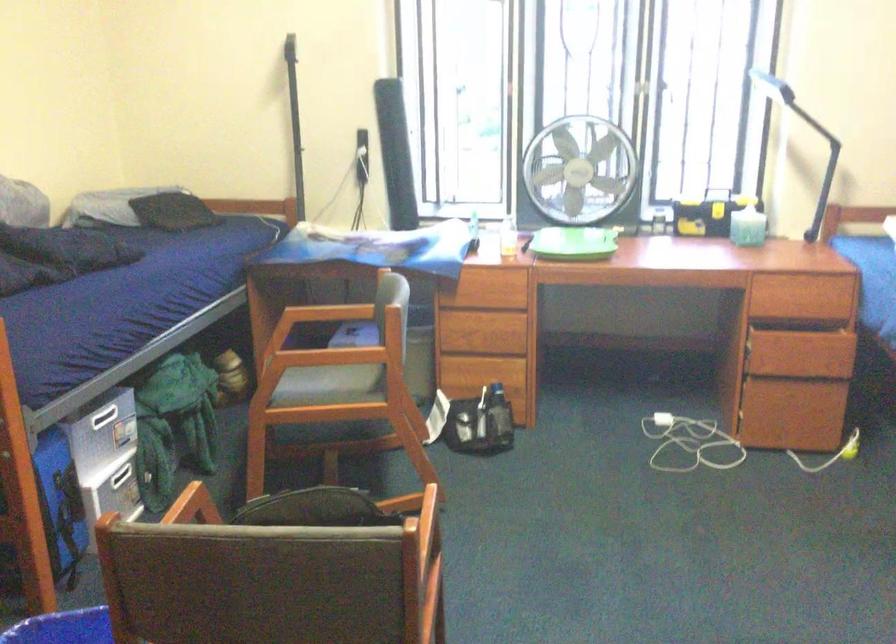
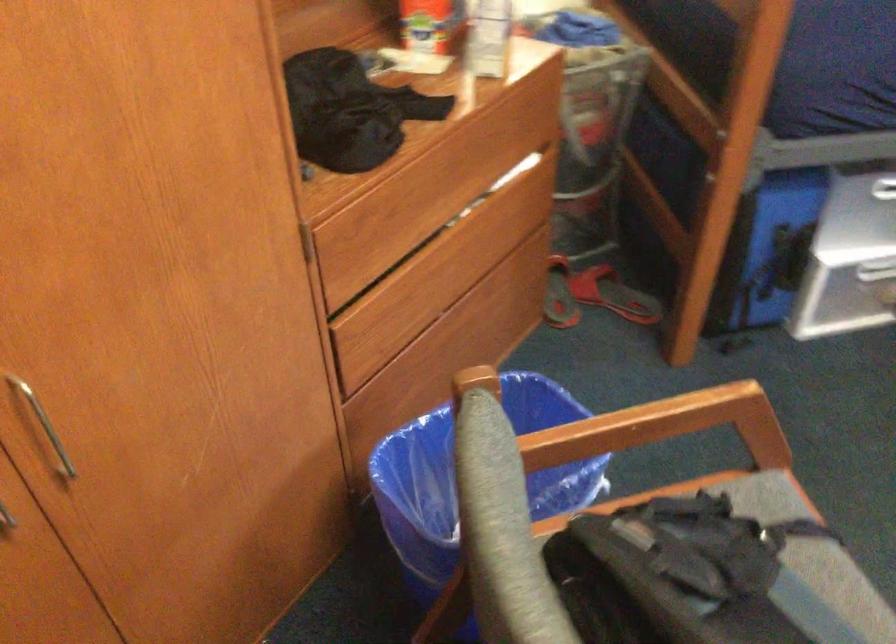
In the second image, find the point that corresponds to [149,538] in the first image.

(487, 460)